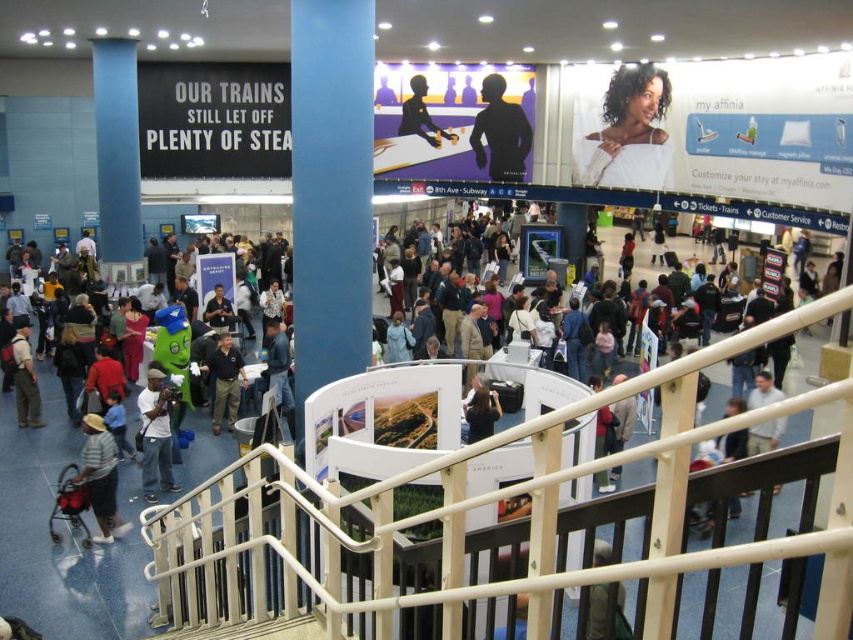
You are standing in the convention center and want to reach the point marked at coordinates (619, 97). If your walking speed is 1.5 meters per second, how many seconds will it take you to reach that point?

The distance to the point is 40.31 meters. At 1.5 mps, it would take 40.31 divided by 1.5, which is approximately 26.87 seconds.

You are standing in the convention center and want to locate the white fabric at upper center. Based on the coordinates provided, can you determine its exact position relative to the center of the image?

The white fabric at upper center is located at coordinates point 0.206 on the x axis and 0.741 on the y axis, which places it slightly to the left and above the center of the image.

Looking at this image, you are standing at the bottom of the staircase and looking upward. You see a white fabric at upper center and a silhouette figure at upper center. Which one is positioned to the right from your viewpoint?

The white fabric at upper center is to the right of the silhouette figure at upper center from your viewpoint.